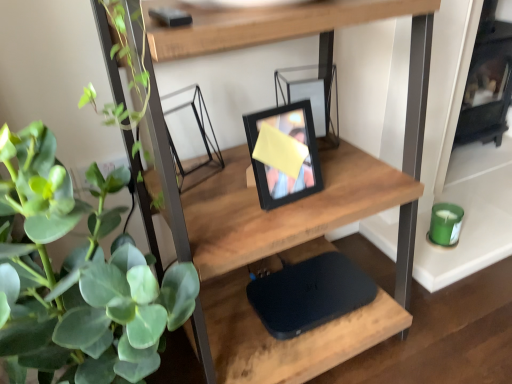
Question: Considering the positions of green matte plant at left and wooden shelf at center in the image, is green matte plant at left bigger or smaller than wooden shelf at center?

Choices:
 (A) big
 (B) small

Answer: (B)

Question: Is green matte plant at left inside the boundaries of wooden shelf at center, or outside?

Choices:
 (A) inside
 (B) outside

Answer: (B)

Question: Which of these objects is positioned farthest from the black glass fireplace at right?

Choices:
 (A) black matte picture frame at center
 (B) wooden shelf at center
 (C) black matte laptop at center
 (D) green matte plant at left

Answer: (D)

Question: Which of these objects is positioned closest to the wooden shelf at center?

Choices:
 (A) black matte picture frame at center
 (B) black matte laptop at center
 (C) green matte plant at left
 (D) black glass fireplace at right

Answer: (A)